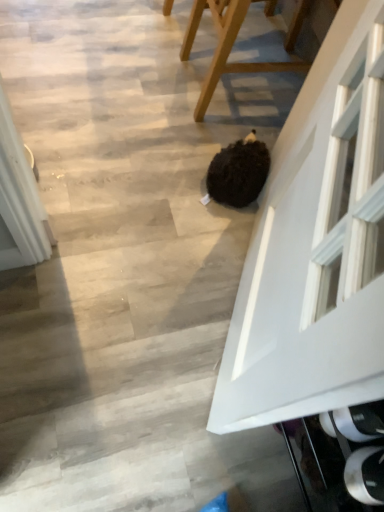
Image resolution: width=384 pixels, height=512 pixels. Find the location of `wooden chair at center`. wooden chair at center is located at coordinates (228, 45).

The image size is (384, 512). Describe the element at coordinates (228, 45) in the screenshot. I see `wooden chair at center` at that location.

What do you see at coordinates (315, 249) in the screenshot? I see `white glossy door at center` at bounding box center [315, 249].

Locate an element on the screen. The image size is (384, 512). white glossy door at center is located at coordinates (315, 249).

Locate an element on the screen. wooden chair at center is located at coordinates (228, 45).

Which object is positioned more to the right, white glossy door at center or wooden chair at center?

From the viewer's perspective, wooden chair at center appears more on the right side.

Which object is closer to the camera taking this photo, white glossy door at center or wooden chair at center?

white glossy door at center is in front.

Between point (261, 211) and point (216, 18), which one is positioned behind?

The point (216, 18) is behind.

From the image's perspective, which one is positioned lower, white glossy door at center or wooden chair at center?

white glossy door at center.

Looking at this image, from a real-world perspective, which object rests below the other?

From a 3D spatial view, wooden chair at center is below.

Considering the sizes of objects white glossy door at center and wooden chair at center in the image provided, who is wider, white glossy door at center or wooden chair at center?

Wider between the two is wooden chair at center.

Who is shorter, white glossy door at center or wooden chair at center?

Standing shorter between the two is wooden chair at center.

Can you confirm if white glossy door at center is bigger than wooden chair at center?

Actually, white glossy door at center might be smaller than wooden chair at center.

Would you say wooden chair at center is part of white glossy door at center's contents?

Definitely not — wooden chair at center is not inside white glossy door at center.

Can you see white glossy door at center touching wooden chair at center?

white glossy door at center and wooden chair at center are not in contact.

Is white glossy door at center oriented towards wooden chair at center?

No, white glossy door at center does not turn towards wooden chair at center.

How much distance is there between white glossy door at center and wooden chair at center?

The distance of white glossy door at center from wooden chair at center is 74.03 centimeters.

Find the location of a particular element. This screenshot has width=384, height=512. glass door that is below the wooden chair at center (from the image's perspective) is located at coordinates (315, 249).

Which is more to the right, wooden chair at center or white glossy door at center?

wooden chair at center.

Considering the positions of objects wooden chair at center and white glossy door at center in the image provided, who is behind, wooden chair at center or white glossy door at center?

wooden chair at center is more distant.

Is point (270, 6) farther from camera compared to point (270, 220)?

Yes, point (270, 6) is behind point (270, 220).

From the image's perspective, is wooden chair at center under white glossy door at center?

Incorrect, from the image's perspective, wooden chair at center is higher than white glossy door at center.

From a real-world perspective, is wooden chair at center physically below white glossy door at center?

Indeed, from a real-world perspective, wooden chair at center is positioned beneath white glossy door at center.

Can you confirm if wooden chair at center is wider than white glossy door at center?

Indeed, wooden chair at center has a greater width compared to white glossy door at center.

Does wooden chair at center have a lesser height compared to white glossy door at center?

Yes, wooden chair at center is shorter than white glossy door at center.

Does wooden chair at center have a larger size compared to white glossy door at center?

Correct, wooden chair at center is larger in size than white glossy door at center.

Is wooden chair at center inside or outside of white glossy door at center?

The correct answer is: outside.

Are wooden chair at center and white glossy door at center far apart?

wooden chair at center is actually quite close to white glossy door at center.

Is wooden chair at center facing away from white glossy door at center?

wooden chair at center does not have its back to white glossy door at center.

The height and width of the screenshot is (512, 384). Identify the location of glass door above the wooden chair at center (from a real-world perspective). (315, 249).

Find the location of a particular element. Image resolution: width=384 pixels, height=512 pixels. glass door below the wooden chair at center (from the image's perspective) is located at coordinates (315, 249).

This screenshot has width=384, height=512. I want to click on furniture that appears below the white glossy door at center (from a real-world perspective), so click(x=228, y=45).